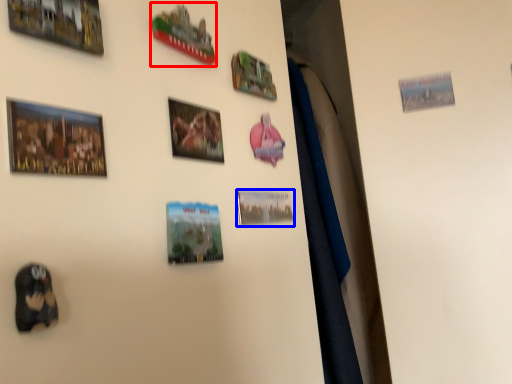
Question: Which point is further to the camera, picture frame (highlighted by a red box) or picture frame (highlighted by a blue box)?

Choices:
 (A) picture frame
 (B) picture frame

Answer: (B)